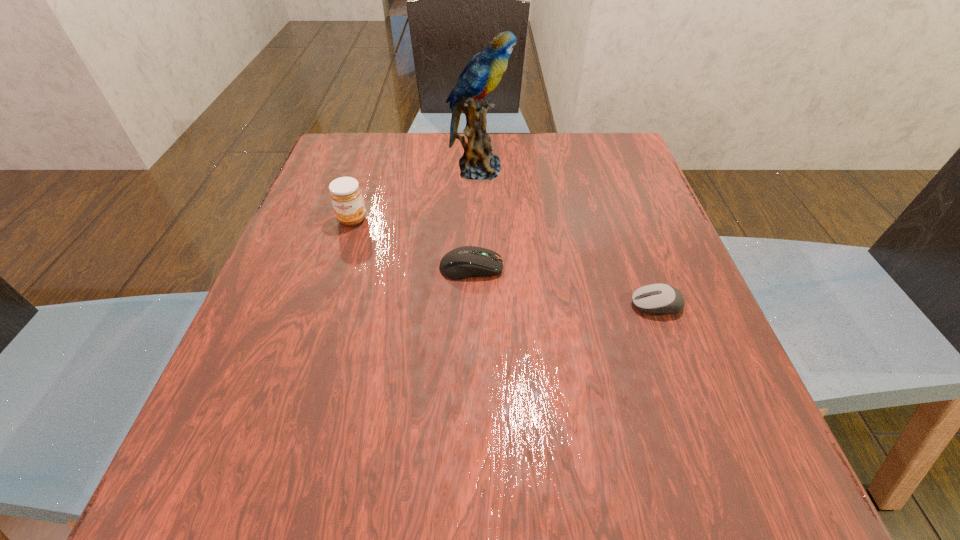
Find the location of a particular element. This screenshot has width=960, height=540. free region at the right edge of the desktop is located at coordinates (657, 277).

The width and height of the screenshot is (960, 540). What are the coordinates of `vacant area at the far left corner of the desktop` in the screenshot? It's located at (362, 160).

At what (x,y) coordinates should I click in order to perform the action: click on blank area at the far right corner. Please return your answer as a coordinate pair (x, y). The width and height of the screenshot is (960, 540). Looking at the image, I should click on (577, 170).

This screenshot has height=540, width=960. Find the location of `unoccupied position between the farther computer equipment and the nearer computer equipment`. unoccupied position between the farther computer equipment and the nearer computer equipment is located at coordinates (564, 286).

At what (x,y) coordinates should I click in order to perform the action: click on vacant area that lies between the second tallest object and the parrot. Please return your answer as a coordinate pair (x, y). The height and width of the screenshot is (540, 960). Looking at the image, I should click on (416, 194).

Where is `free spot between the shorter computer equipment and the second nearest object`? free spot between the shorter computer equipment and the second nearest object is located at coordinates (564, 286).

I want to click on unoccupied position between the leftmost object and the rightmost object, so click(x=504, y=262).

Image resolution: width=960 pixels, height=540 pixels. What are the coordinates of `vacant space that is in between the second farthest object and the left computer equipment` in the screenshot? It's located at (412, 244).

Locate an element on the screen. The image size is (960, 540). unoccupied area between the shorter computer equipment and the tallest object is located at coordinates (567, 237).

The width and height of the screenshot is (960, 540). What are the coordinates of `free space between the second farthest object and the farther computer equipment` in the screenshot? It's located at (412, 244).